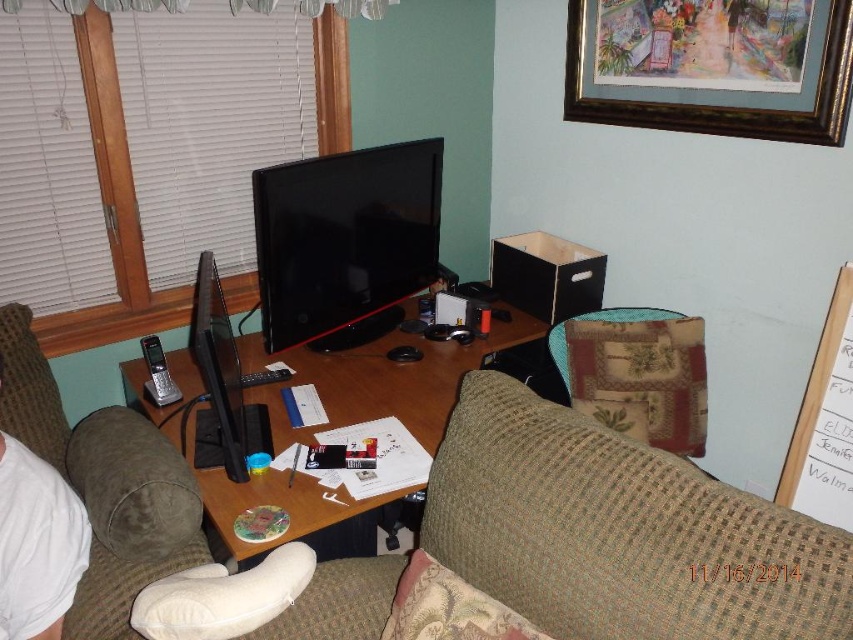
You are standing in the home office and want to pick up an item from the desk. The first item is located at point (x=732, y=621) and the second item is at point (x=392, y=243). Which item will you reach first if you move directly towards them?

The item at point (x=732, y=621) will be reached first because it is closer to you than the item at point (x=392, y=243).

Looking at this image, you are trying to decide whether to place a new rectangular box on the green fabric swivel chair at center or the black glossy computer desk at center. Based on their shapes, which object is more likely to provide a stable surface for the box?

The black glossy computer desk at center is more likely to provide a stable surface for the box because it is wider than the green fabric swivel chair at center.

You are a delivery person trying to place a large package that requires 18 inches of space between the green fabric swivel chair at center and the black glossy computer desk at center. Can you fit it there?

The distance between the green fabric swivel chair at center and the black glossy computer desk at center is 17.78 inches, which is slightly less than the required 18 inches. Therefore, the package cannot be placed there due to insufficient space.